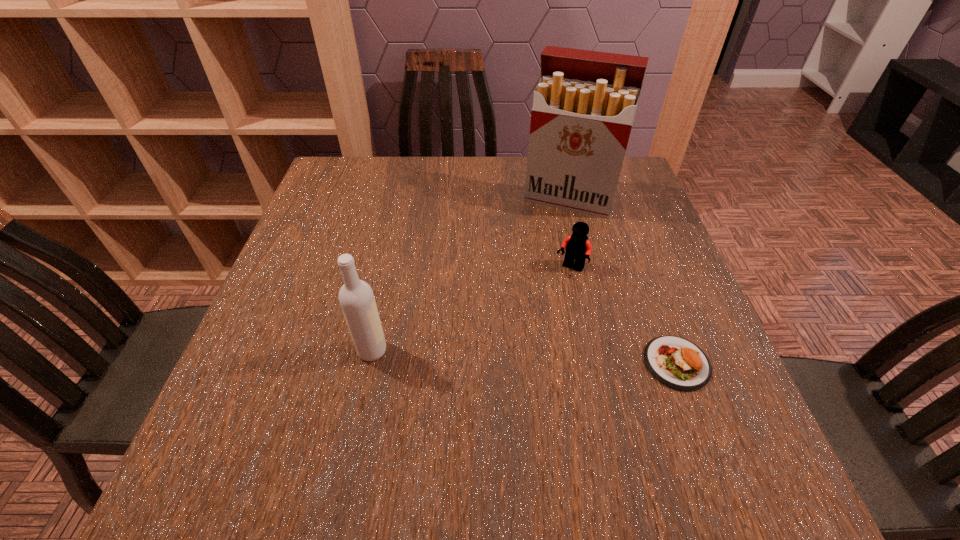
The image size is (960, 540). What are the coordinates of `blank space that satisfies the following two spatial constraints: 1. on the front side of the third nearest object; 2. on the right side of the patty (food)` in the screenshot? It's located at (590, 363).

At what (x,y) coordinates should I click in order to perform the action: click on vacant region that satisfies the following two spatial constraints: 1. on the back side of the farthest object; 2. on the left side of the vodka. Please return your answer as a coordinate pair (x, y). The image size is (960, 540). Looking at the image, I should click on (404, 199).